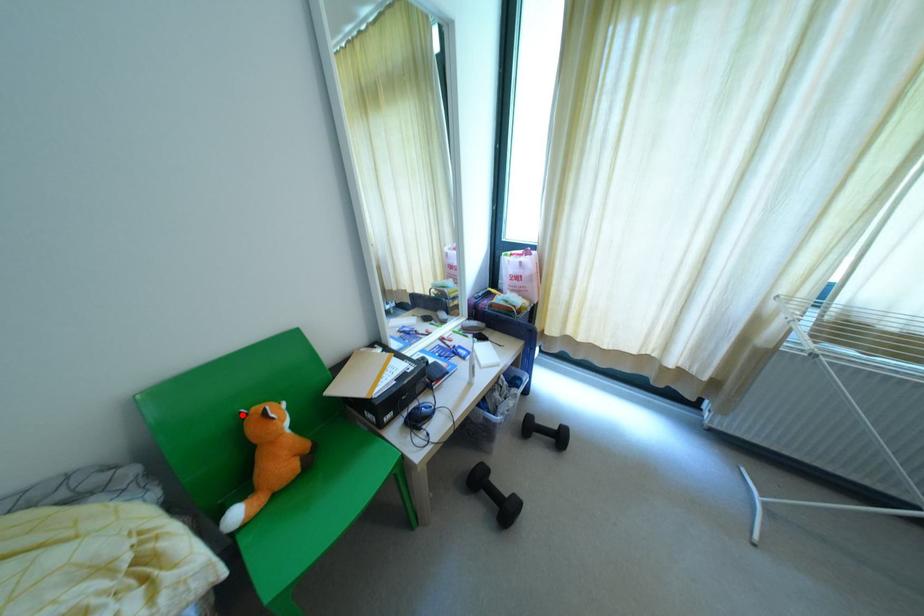
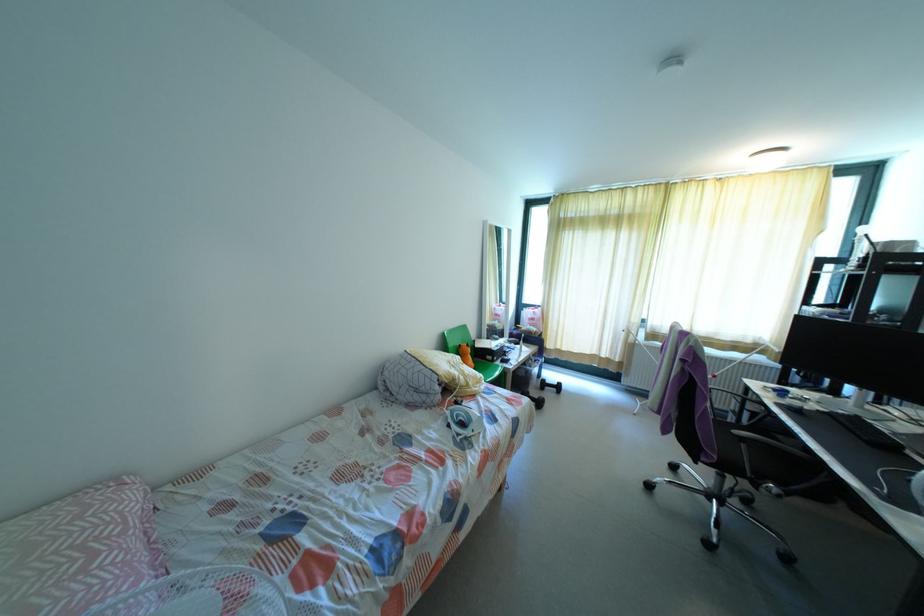
Locate, in the second image, the point that corresponds to the highlighted location in the first image.

(458, 345)